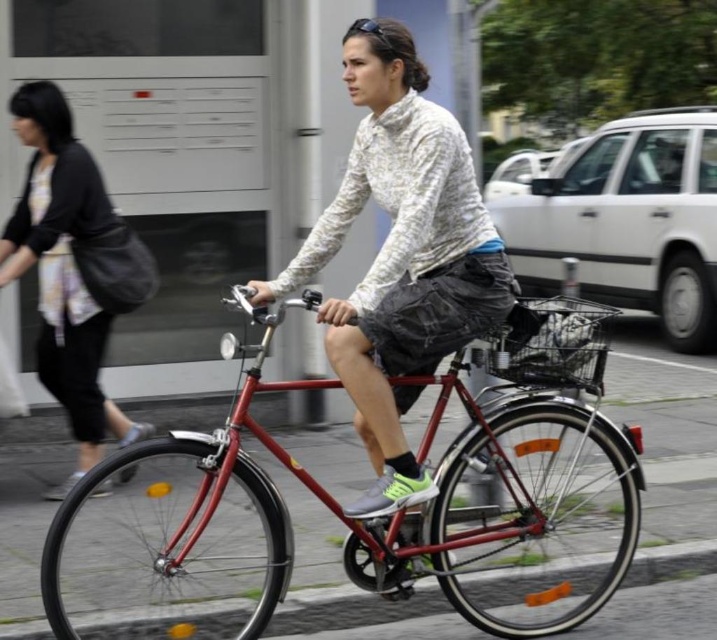
Who is higher up, white textured shirt at center or matte black jacket at left?

white textured shirt at center

Looking at this image, is white textured shirt at center in front of matte black jacket at left?

Yes, it is in front of matte black jacket at left.

You are a GUI agent. You are given a task and a screenshot of the screen. Output one action in this format:
    pyautogui.click(x=<x>, y=<y>)
    Task: Click on the white textured shirt at center
    
    Given the screenshot: What is the action you would take?
    tap(399, 256)

Does metallic red bicycle at center have a greater height compared to matte black jacket at left?

No, metallic red bicycle at center is not taller than matte black jacket at left.

Measure the distance between metallic red bicycle at center and camera.

metallic red bicycle at center is 11.14 feet away from camera.

Does point (522, 372) lie in front of point (113, 257)?

Yes, it is in front of point (113, 257).

In order to click on metallic red bicycle at center in this screenshot , I will do `click(366, 518)`.

Is point (313, 481) behind point (398, 276)?

Yes, it is.

Identify the location of metallic red bicycle at center. This screenshot has width=717, height=640. (366, 518).

You are a GUI agent. You are given a task and a screenshot of the screen. Output one action in this format:
    pyautogui.click(x=<x>, y=<y>)
    Task: Click on the metallic red bicycle at center
    
    Given the screenshot: What is the action you would take?
    pyautogui.click(x=366, y=518)